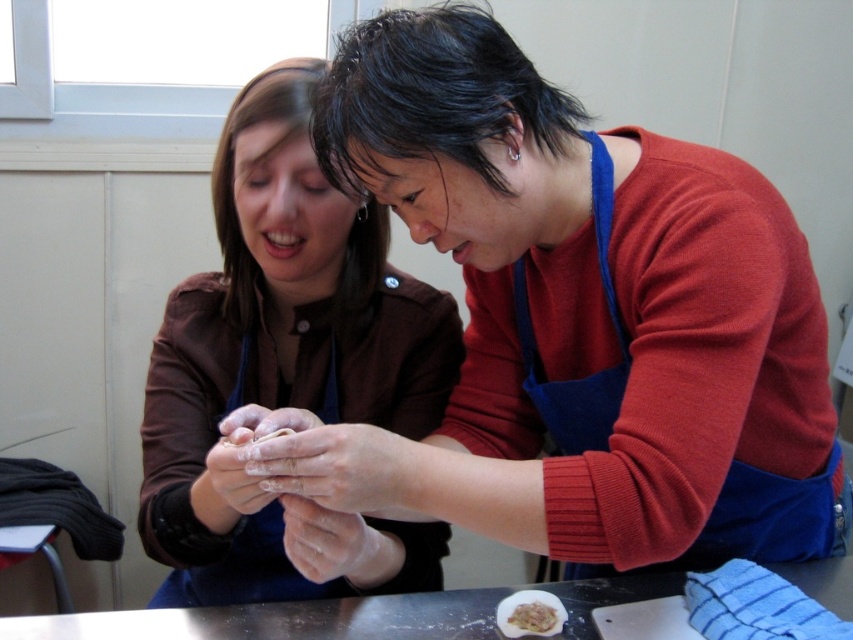
I want to click on white floury hand at center, so click(331, 544).

Between white floury hand at center and white fluffy dough at lower center, which one is positioned lower?

white fluffy dough at lower center is lower down.

Does point (345, 529) come farther from viewer compared to point (529, 608)?

No, (345, 529) is closer to viewer.

This screenshot has width=853, height=640. Identify the location of white floury hand at center. (331, 544).

Does point (296, 627) come behind point (297, 556)?

Yes, point (296, 627) is farther from viewer.

Is metallic silver table at center further to camera compared to white floury hand at center?

Yes, metallic silver table at center is behind white floury hand at center.

Does point (241, 620) come behind point (305, 529)?

Yes.

The width and height of the screenshot is (853, 640). I want to click on metallic silver table at center, so click(x=283, y=620).

Based on the photo, does matte brown apron at center have a greater height compared to white fluffy dough at lower center?

Yes.

Describe the element at coordinates (283, 356) in the screenshot. I see `matte brown apron at center` at that location.

Where is `matte brown apron at center`? The width and height of the screenshot is (853, 640). matte brown apron at center is located at coordinates (283, 356).